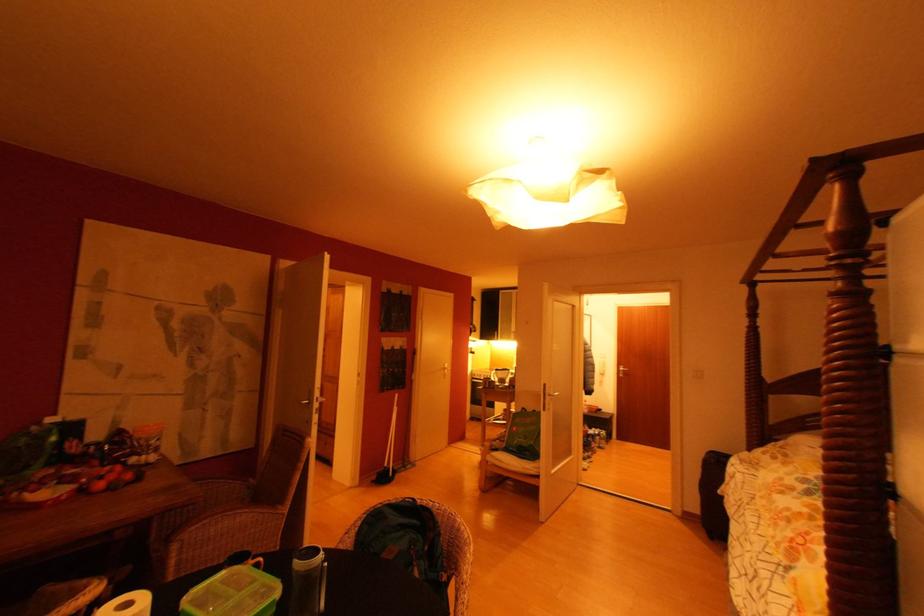
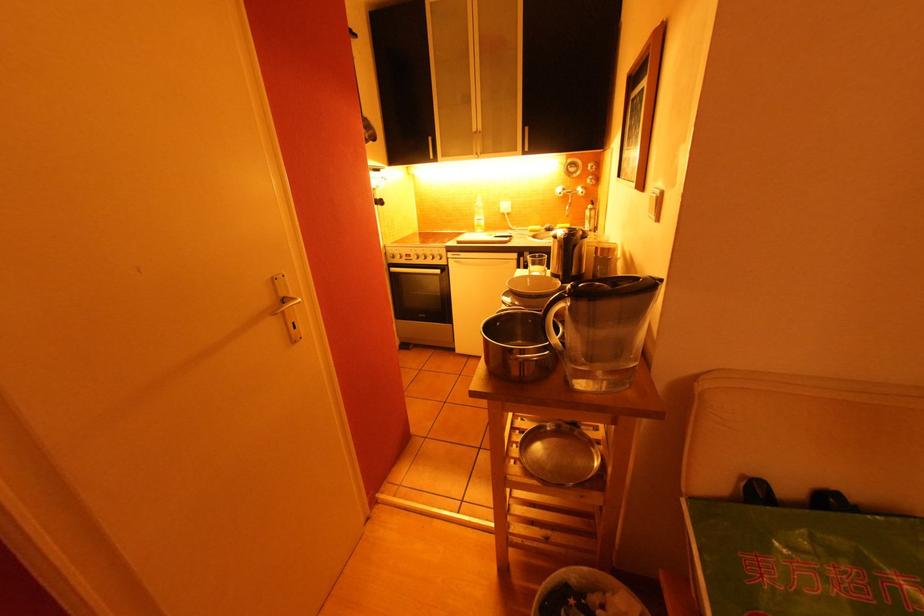
The point at [476,415] is marked in the first image. Where is the corresponding point in the second image?

(405, 339)